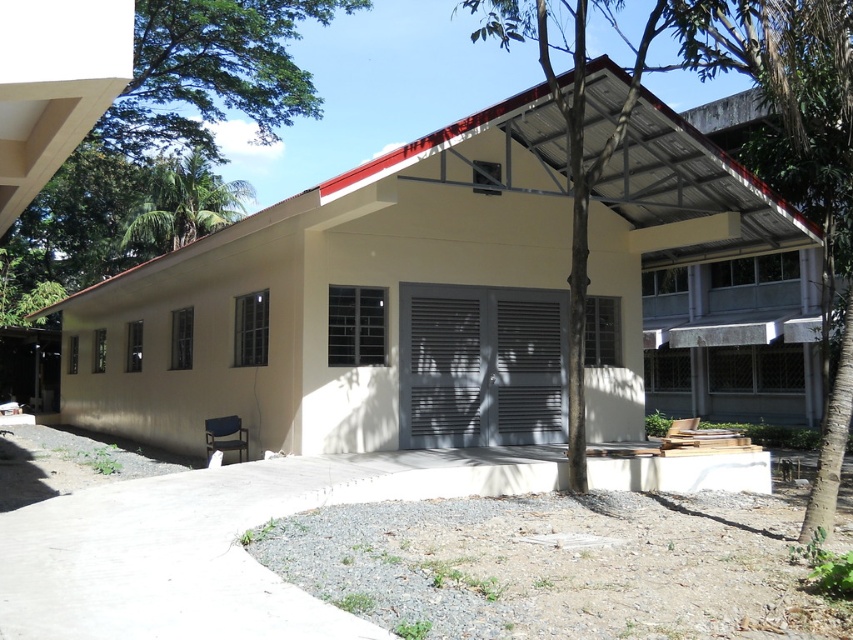
Question: Is green leafy tree at center further to the viewer compared to green leafy tree at upper left?

Choices:
 (A) no
 (B) yes

Answer: (A)

Question: Can you confirm if green leafy tree at center is wider than green leafy tree at upper left?

Choices:
 (A) no
 (B) yes

Answer: (B)

Question: Which point is farther to the camera?

Choices:
 (A) green leafy tree at upper left
 (B) green leafy tree at center

Answer: (A)

Question: Which object is farther from the camera taking this photo?

Choices:
 (A) green leafy tree at upper left
 (B) green leafy tree at center

Answer: (A)

Question: Considering the relative positions of green leafy tree at center and green leafy tree at upper left in the image provided, where is green leafy tree at center located with respect to green leafy tree at upper left?

Choices:
 (A) left
 (B) right

Answer: (B)

Question: Which object is farther from the camera taking this photo?

Choices:
 (A) green leafy tree at center
 (B) green leafy tree at upper left

Answer: (B)